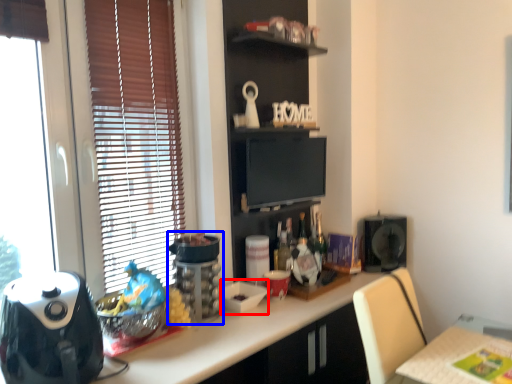
Question: Among these objects, which one is nearest to the camera, appliance (highlighted by a red box) or appliance (highlighted by a blue box)?

Choices:
 (A) appliance
 (B) appliance

Answer: (B)